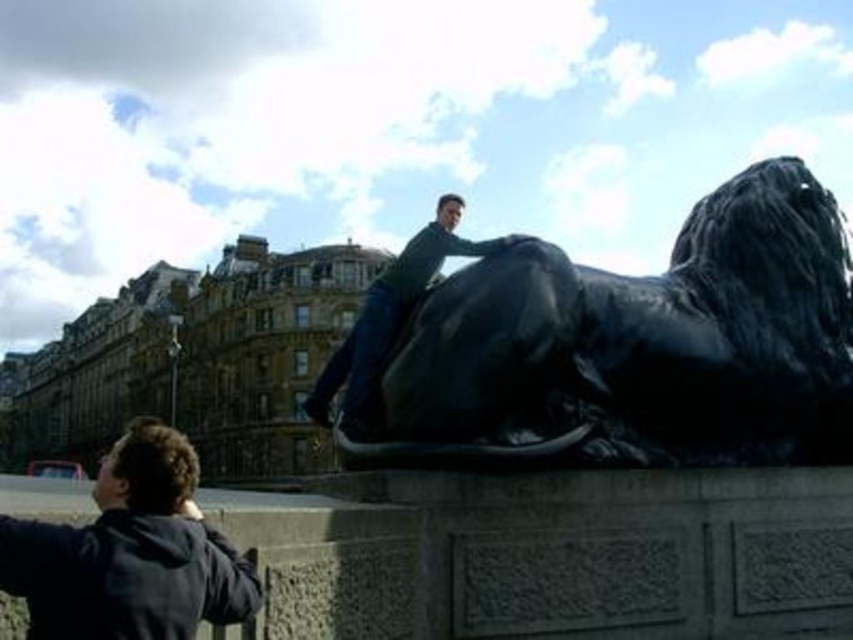
Question: Which point appears farthest from the camera in this image?

Choices:
 (A) coord(109,579)
 (B) coord(531,305)

Answer: (B)

Question: Is black polished stone lion at upper center to the right of dark blue jacket at lower left from the viewer's perspective?

Choices:
 (A) no
 (B) yes

Answer: (B)

Question: Among these objects, which one is farthest from the camera?

Choices:
 (A) black polished stone lion at upper center
 (B) dark blue jacket at lower left

Answer: (A)

Question: Is dark blue jacket at lower left behind matte black statue at center?

Choices:
 (A) yes
 (B) no

Answer: (B)

Question: Which point appears closest to the camera in this image?

Choices:
 (A) (444, 212)
 (B) (421, 426)

Answer: (B)

Question: Is black polished stone lion at upper center to the right of dark blue jacket at lower left from the viewer's perspective?

Choices:
 (A) no
 (B) yes

Answer: (B)